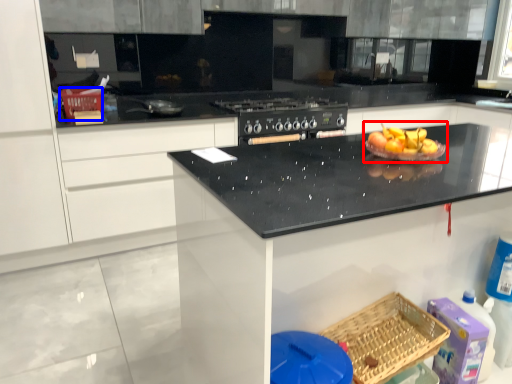
Question: Which object is closer to the camera taking this photo, fruit dish (highlighted by a red box) or basket (highlighted by a blue box)?

Choices:
 (A) fruit dish
 (B) basket

Answer: (A)